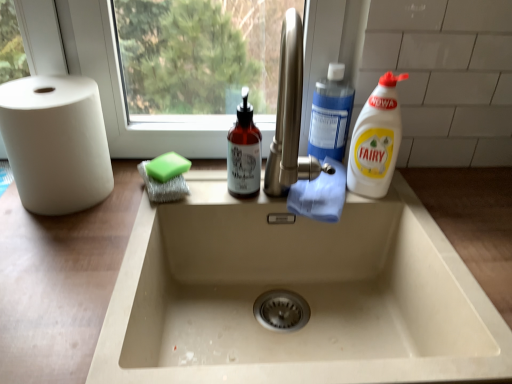
Locate an element on the screen. vacant area that is in front of green sponge at upper left is located at coordinates (117, 233).